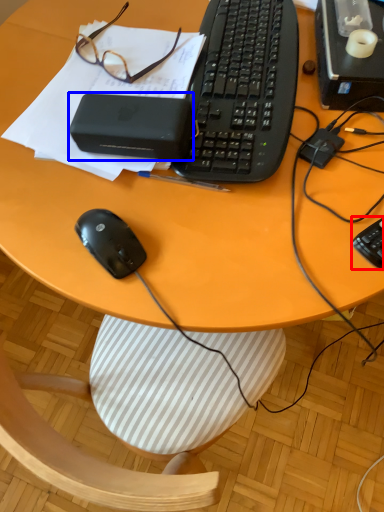
Question: Which of the following is the closest to the observer, computer keyboard (highlighted by a red box) or gadget (highlighted by a blue box)?

Choices:
 (A) computer keyboard
 (B) gadget

Answer: (A)